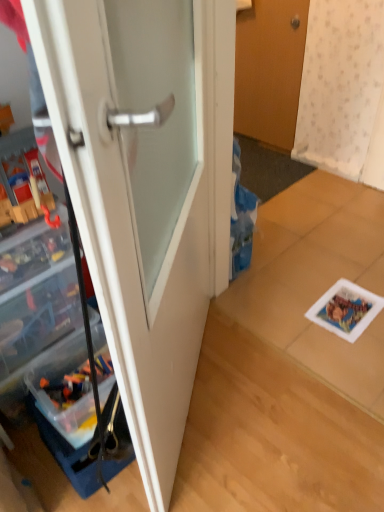
Question: Can you confirm if white glossy door at center, arranged as the 1th door when viewed from the front, is shorter than clear plastic cabinet at left?

Choices:
 (A) yes
 (B) no

Answer: (B)

Question: From a real-world perspective, is white glossy door at center, placed as the 2th door when sorted from back to front, on clear plastic cabinet at left?

Choices:
 (A) yes
 (B) no

Answer: (B)

Question: Considering the relative positions of white glossy door at center, the 2th door from the top, and clear plastic cabinet at left in the image provided, is white glossy door at center, the 2th door from the top, in front of clear plastic cabinet at left?

Choices:
 (A) yes
 (B) no

Answer: (A)

Question: Is white glossy door at center, marked as the second door in a right-to-left arrangement, at the right side of clear plastic cabinet at left?

Choices:
 (A) no
 (B) yes

Answer: (B)

Question: Is white glossy door at center, the 2th door from the top, turned away from clear plastic cabinet at left?

Choices:
 (A) no
 (B) yes

Answer: (B)

Question: In terms of width, does clear plastic cabinet at left look wider or thinner when compared to white glossy door at center, marked as the second door in a right-to-left arrangement?

Choices:
 (A) wide
 (B) thin

Answer: (B)

Question: From their relative heights in the image, would you say clear plastic cabinet at left is taller or shorter than white glossy door at center, arranged as the 1th door when viewed from the front?

Choices:
 (A) short
 (B) tall

Answer: (A)

Question: From a real-world perspective, is clear plastic cabinet at left physically located above or below white glossy door at center, marked as the second door in a right-to-left arrangement?

Choices:
 (A) above
 (B) below

Answer: (A)

Question: Based on their sizes in the image, would you say clear plastic cabinet at left is bigger or smaller than white glossy door at center, arranged as the 1th door when viewed from the front?

Choices:
 (A) small
 (B) big

Answer: (A)

Question: Relative to wooden door at upper center, which is counted as the 1th door, starting from the right, is white glossy door at center, marked as the second door in a right-to-left arrangement, in front or behind?

Choices:
 (A) behind
 (B) front

Answer: (B)

Question: From a real-world perspective, is white glossy door at center, placed as the 2th door when sorted from back to front, physically located above or below wooden door at upper center, which is the second door in bottom-to-top order?

Choices:
 (A) above
 (B) below

Answer: (A)

Question: Based on their sizes in the image, would you say white glossy door at center, marked as the second door in a right-to-left arrangement, is bigger or smaller than wooden door at upper center, which is counted as the 1th door, starting from the right?

Choices:
 (A) big
 (B) small

Answer: (A)

Question: From their relative heights in the image, would you say white glossy door at center, placed as the 2th door when sorted from back to front, is taller or shorter than wooden door at upper center, which is counted as the 1th door, starting from the right?

Choices:
 (A) short
 (B) tall

Answer: (B)

Question: Is wooden door at upper center, marked as the 2th door in a left-to-right arrangement, to the left or to the right of white glossy door at center, the 2th door from the top, in the image?

Choices:
 (A) left
 (B) right

Answer: (B)

Question: Considering their positions, is wooden door at upper center, which is the second door in bottom-to-top order, located in front of or behind white glossy door at center, the 2th door from the top?

Choices:
 (A) front
 (B) behind

Answer: (B)